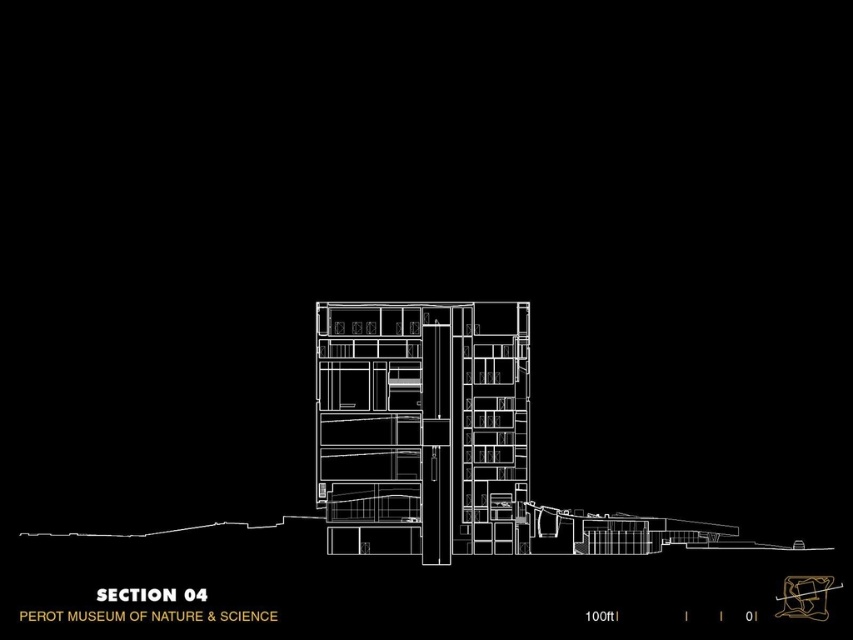
You are an architect reviewing the Perot Museum section drawing. You need to determine which of the two points, point (332, 340) or point (811, 592), is closer to the viewer in this section view. Based on the drawing, which point is nearer?

Point (332, 340) is closer to the camera than point (811, 592).

Based on the architectural drawing labeled SECTION 04, which object at the center of the Perot Museum of Nature and Science is wider? The translucent glass building at center or the matte gold sculpture at center?

The translucent glass building at center is wider than the matte gold sculpture at center according to the drawing.

Based on the architectural drawing labeled with the Perot Museum of Nature and Science, which object is taller between the translucent glass building at center and the matte gold sculpture at center?

The translucent glass building at center is taller than the matte gold sculpture at center according to the drawing.